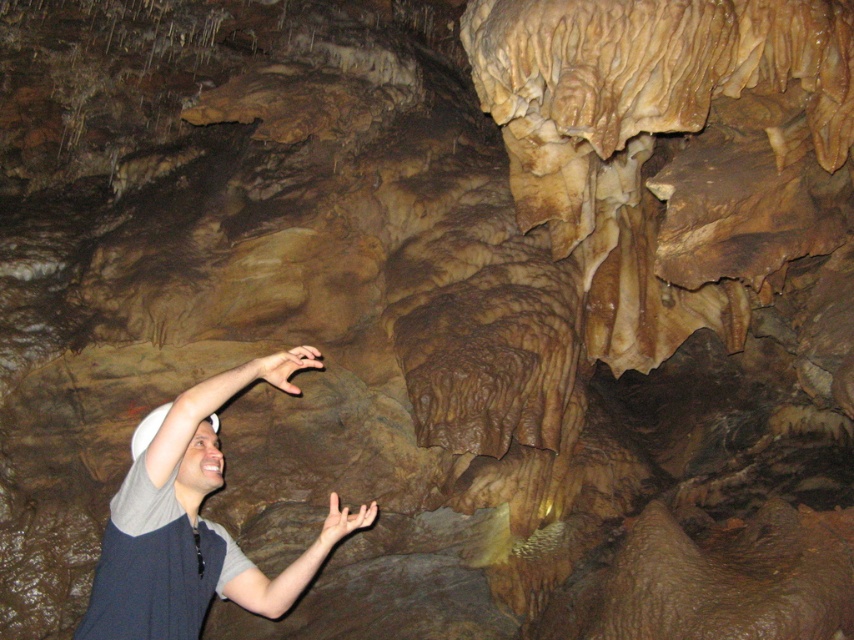
You are inside the cave and see the gray fabric shirt at lower left and the matte brown hand at lower center. Which object is positioned more to the left?

The gray fabric shirt at lower left is positioned more to the left than the matte brown hand at lower center.

You are a photographer trying to capture both the gray fabric shirt at lower left and the pink flesh at center in a single frame. Which object should you focus on first to ensure both are in the frame?

The gray fabric shirt at lower left is larger in size than the pink flesh at center, so you should focus on the gray fabric shirt at lower left first to ensure both are in the frame.

You are an explorer in the cave and need to determine which object has a greater width between the gray fabric shirt at lower left and the matte brown hand at lower center. Based on the scene, which one is wider?

The gray fabric shirt at lower left has a greater width than the matte brown hand at lower center according to the description.